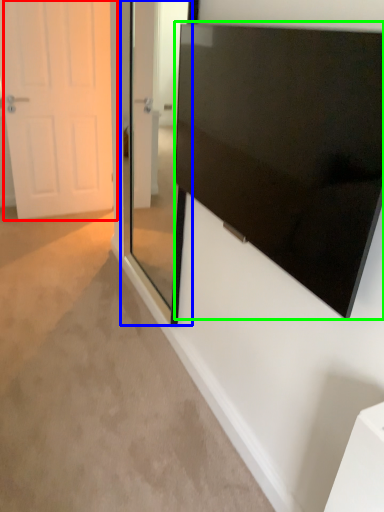
Question: Based on their relative distances, which object is farther from door (highlighted by a red box)? Choose from glass door (highlighted by a blue box) and screen (highlighted by a green box).

Choices:
 (A) glass door
 (B) screen

Answer: (B)